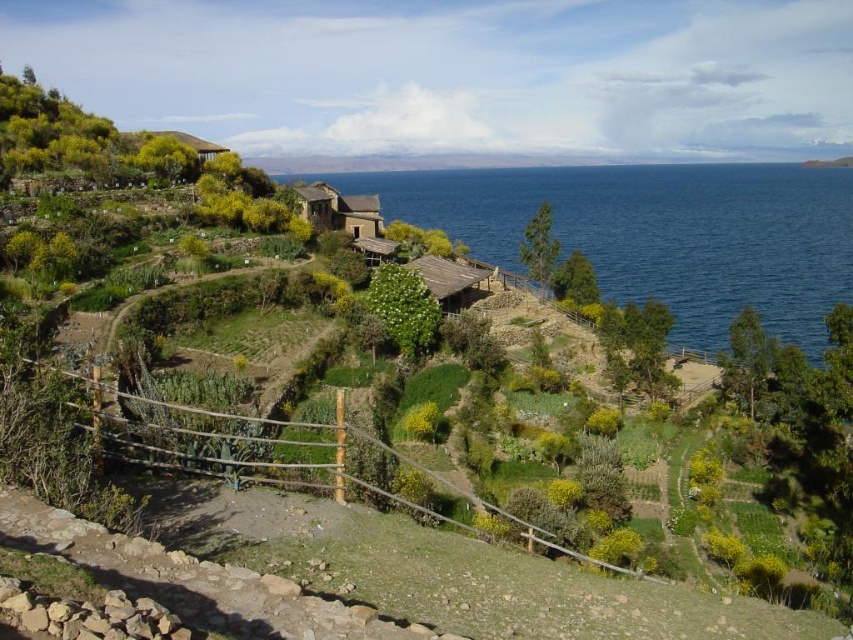
Question: Estimate the real-world distances between objects in this image. Which object is farther from the wooden hut at upper left?

Choices:
 (A) wooden hut at center
 (B) rustic stone hut at center
 (C) blue water at center

Answer: (C)

Question: Among these points, which one is nearest to the camera?

Choices:
 (A) (451, 301)
 (B) (474, 236)
 (C) (323, 209)

Answer: (A)

Question: Is blue water at center bigger than wooden hut at center?

Choices:
 (A) no
 (B) yes

Answer: (B)

Question: Does rustic stone hut at center appear on the right side of wooden hut at center?

Choices:
 (A) yes
 (B) no

Answer: (B)

Question: Considering the real-world distances, which object is closest to the wooden hut at upper left?

Choices:
 (A) rustic stone hut at center
 (B) wooden hut at center

Answer: (A)

Question: Is blue water at center above wooden hut at upper left?

Choices:
 (A) no
 (B) yes

Answer: (A)